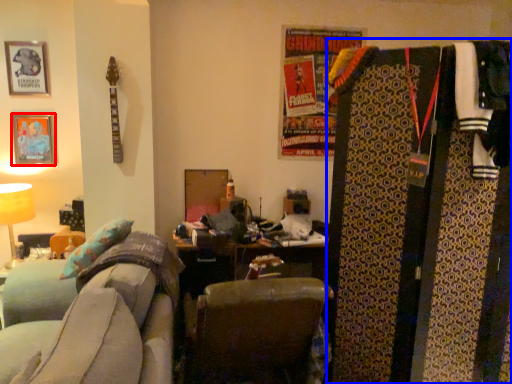
Question: Which point is further to the camera, picture frame (highlighted by a red box) or dresser (highlighted by a blue box)?

Choices:
 (A) picture frame
 (B) dresser

Answer: (A)